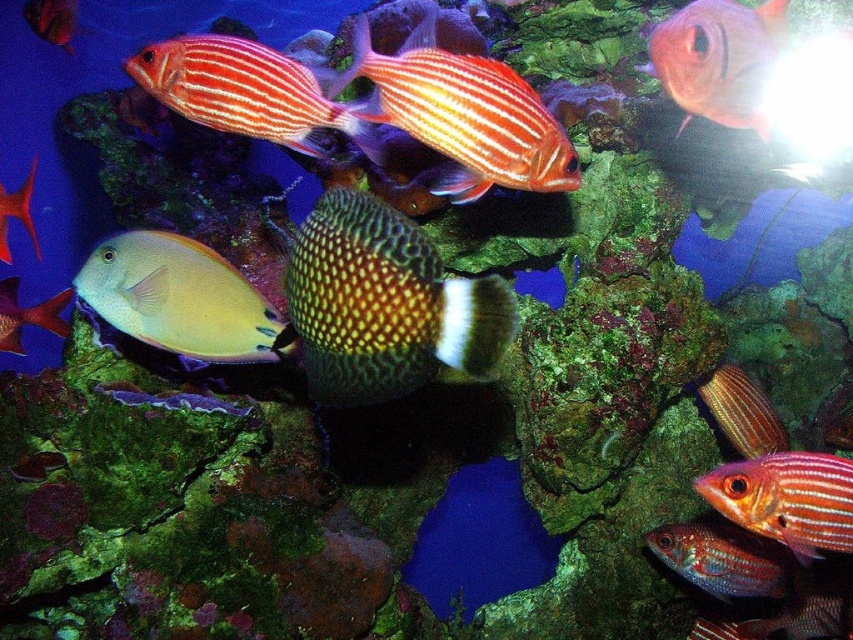
You are a marine biologist observing the aquarium. You notice an orange striped fish at upper center and a pale yellow fish with a rounded body and a slightly translucent appearance on the left. How far apart are these two fish?

The orange striped fish at upper center and the pale yellow fish with a rounded body and a slightly translucent appearance on the left are 1.58 meters apart.

You are an underwater photographer aiming to capture both the orange striped fish at center and the matte yellow fish at left in a single frame. Based on their positions, which fish should you adjust your camera to focus on first to ensure both are in the shot?

The orange striped fish at center is positioned on the right side of matte yellow fish at left. To capture both in a single frame, focus on the matte yellow fish at left first since it is closer to the left edge, allowing the orange striped fish at center to naturally fall into the right side of the frame.

You are an underwater photographer aiming to capture the orange striped fish at center and the matte yellow fish at left. Since you want to focus on the larger fish, which one should you choose to ensure it fills your camera frame better?

The orange striped fish at center has a greater height compared to the matte yellow fish at left, so it should be chosen to fill the camera frame better due to its larger size.